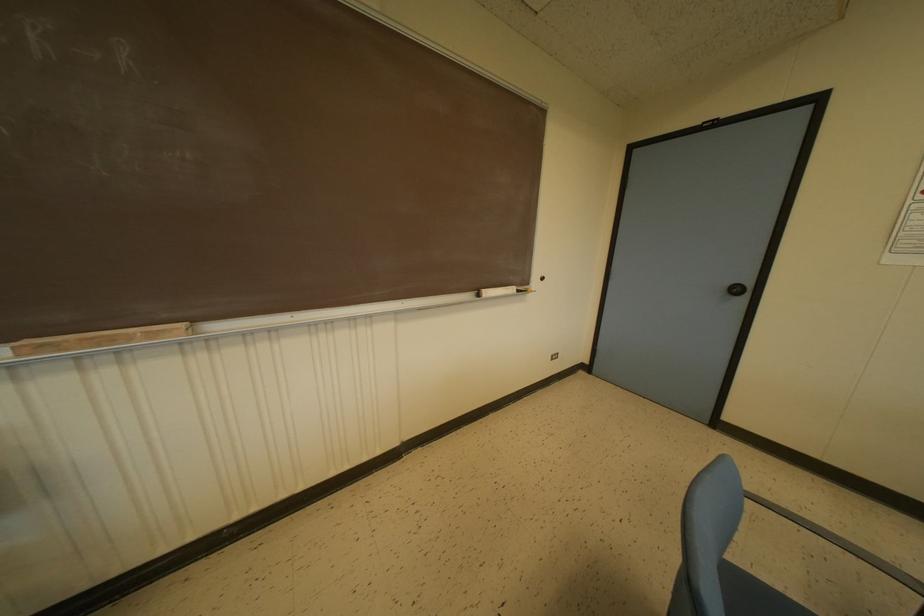
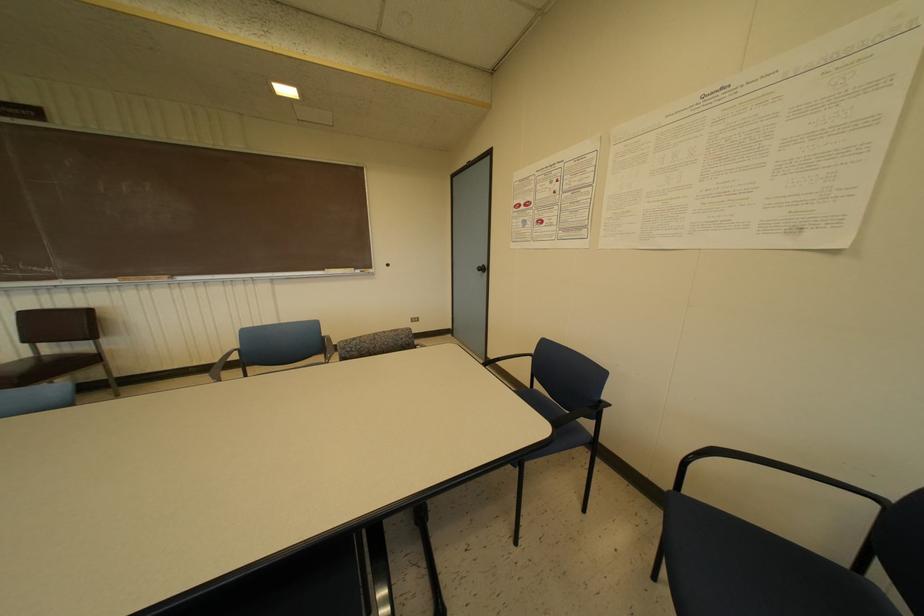
Which direction would the cameraman need to move to produce the second image?

The cameraman moved toward right, backward.